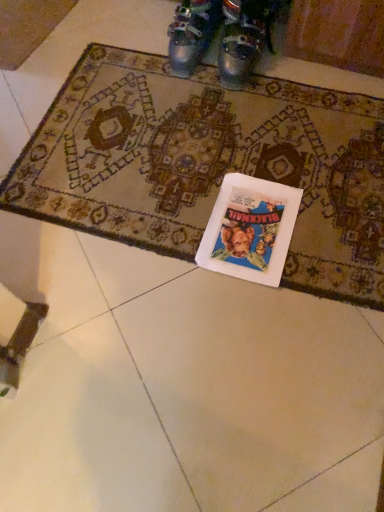
Where is `unoccupied area in front of metallic silver shoes at upper center, arranged as the 1th footwear when viewed from the right`? unoccupied area in front of metallic silver shoes at upper center, arranged as the 1th footwear when viewed from the right is located at coordinates (253, 102).